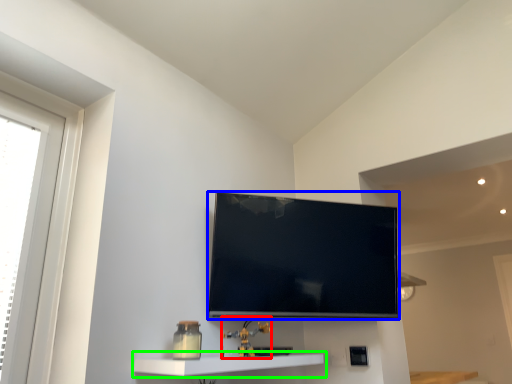
Question: Which is nearer to the toy (highlighted by a red box)? television (highlighted by a blue box) or shelf (highlighted by a green box).

Choices:
 (A) television
 (B) shelf

Answer: (B)